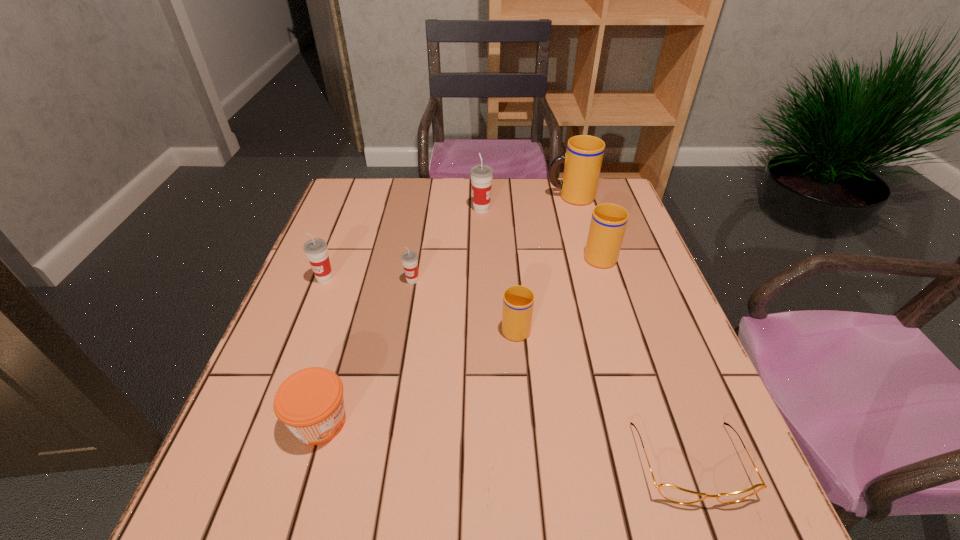
The width and height of the screenshot is (960, 540). I want to click on the biggest beige cup, so click(582, 161).

Where is `the rightmost red cup`? This screenshot has width=960, height=540. the rightmost red cup is located at coordinates (481, 174).

Find the location of a particular element. This screenshot has height=540, width=960. the fourth object from left to right is located at coordinates (481, 174).

The image size is (960, 540). Identify the location of the leftmost red cup. (316, 250).

The image size is (960, 540). Find the location of `the second smallest red cup`. the second smallest red cup is located at coordinates (316, 250).

In order to click on the second farthest beige cup in this screenshot , I will do `click(608, 222)`.

Where is `the second biggest beige cup`? Image resolution: width=960 pixels, height=540 pixels. the second biggest beige cup is located at coordinates (608, 222).

Locate an element on the screen. The width and height of the screenshot is (960, 540). the third cup from right to left is located at coordinates tap(518, 301).

I want to click on the fourth object from right to left, so point(518,301).

At what (x,y) coordinates should I click in order to perform the action: click on the fifth cup from right to left. Please return your answer as a coordinate pair (x, y). Looking at the image, I should click on (409, 258).